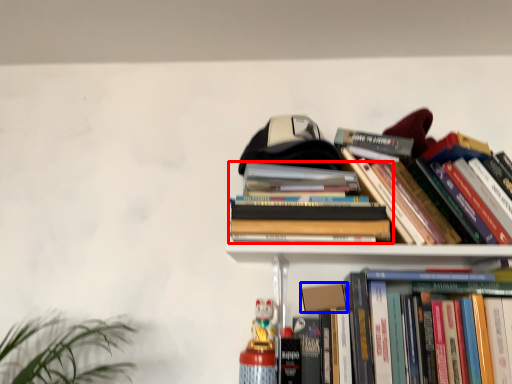
Question: Among these objects, which one is nearest to the camera, book (highlighted by a red box) or paperback book (highlighted by a blue box)?

Choices:
 (A) book
 (B) paperback book

Answer: (A)